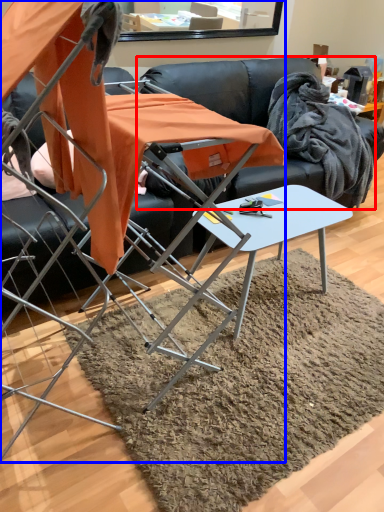
Question: Which point is further to the camera, couch (highlighted by a red box) or chair (highlighted by a blue box)?

Choices:
 (A) couch
 (B) chair

Answer: (A)